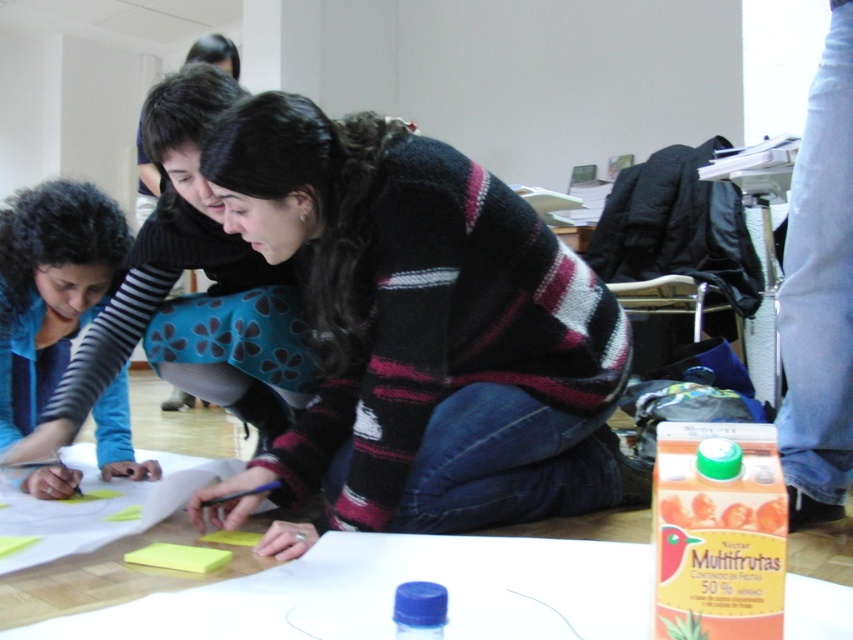
Question: Is knitted sweater at center below white paper at center?

Choices:
 (A) no
 (B) yes

Answer: (A)

Question: Considering the real-world distances, which object is farthest from the white paper at center?

Choices:
 (A) knitted sweater at center
 (B) yellow paper at center
 (C) blue fabric shirt at lower left

Answer: (C)

Question: Which of the following is the closest to the observer?

Choices:
 (A) (477, 483)
 (B) (231, 461)

Answer: (A)

Question: Does knitted sweater at center have a greater width compared to blue fabric shirt at lower left?

Choices:
 (A) yes
 (B) no

Answer: (A)

Question: Which object appears farthest from the camera in this image?

Choices:
 (A) white paper at center
 (B) blue fabric shirt at lower left
 (C) knitted sweater at center

Answer: (B)

Question: Can you confirm if knitted sweater at center is bigger than white paper at center?

Choices:
 (A) yes
 (B) no

Answer: (A)